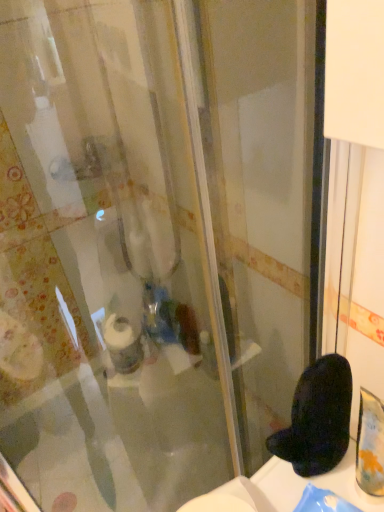
Question: From a real-world perspective, is white matte toilet paper at center physically above black fuzzy slipper at lower right?

Choices:
 (A) yes
 (B) no

Answer: (B)

Question: Considering the relative sizes of white matte toilet paper at center and black fuzzy slipper at lower right in the image provided, is white matte toilet paper at center wider than black fuzzy slipper at lower right?

Choices:
 (A) yes
 (B) no

Answer: (B)

Question: Can you confirm if white matte toilet paper at center is positioned to the right of black fuzzy slipper at lower right?

Choices:
 (A) yes
 (B) no

Answer: (B)

Question: Does white matte toilet paper at center come behind black fuzzy slipper at lower right?

Choices:
 (A) yes
 (B) no

Answer: (A)

Question: Considering the relative positions of white matte toilet paper at center and black fuzzy slipper at lower right in the image provided, is white matte toilet paper at center in front of black fuzzy slipper at lower right?

Choices:
 (A) yes
 (B) no

Answer: (B)

Question: Is white matte toilet paper at center bigger than black fuzzy slipper at lower right?

Choices:
 (A) yes
 (B) no

Answer: (A)

Question: Are black fuzzy slipper at lower right and white matte toilet paper at center beside each other?

Choices:
 (A) no
 (B) yes

Answer: (A)

Question: Does black fuzzy slipper at lower right have a lesser width compared to white matte toilet paper at center?

Choices:
 (A) yes
 (B) no

Answer: (B)

Question: Considering the relative sizes of black fuzzy slipper at lower right and white matte toilet paper at center in the image provided, is black fuzzy slipper at lower right shorter than white matte toilet paper at center?

Choices:
 (A) yes
 (B) no

Answer: (A)

Question: Is black fuzzy slipper at lower right to the right of white matte toilet paper at center from the viewer's perspective?

Choices:
 (A) yes
 (B) no

Answer: (A)

Question: Could you tell me if black fuzzy slipper at lower right is facing white matte toilet paper at center?

Choices:
 (A) yes
 (B) no

Answer: (B)

Question: Is black fuzzy slipper at lower right not within white matte toilet paper at center?

Choices:
 (A) yes
 (B) no

Answer: (A)

Question: Considering the positions of point (127, 371) and point (322, 431), is point (127, 371) closer or farther from the camera than point (322, 431)?

Choices:
 (A) closer
 (B) farther

Answer: (B)